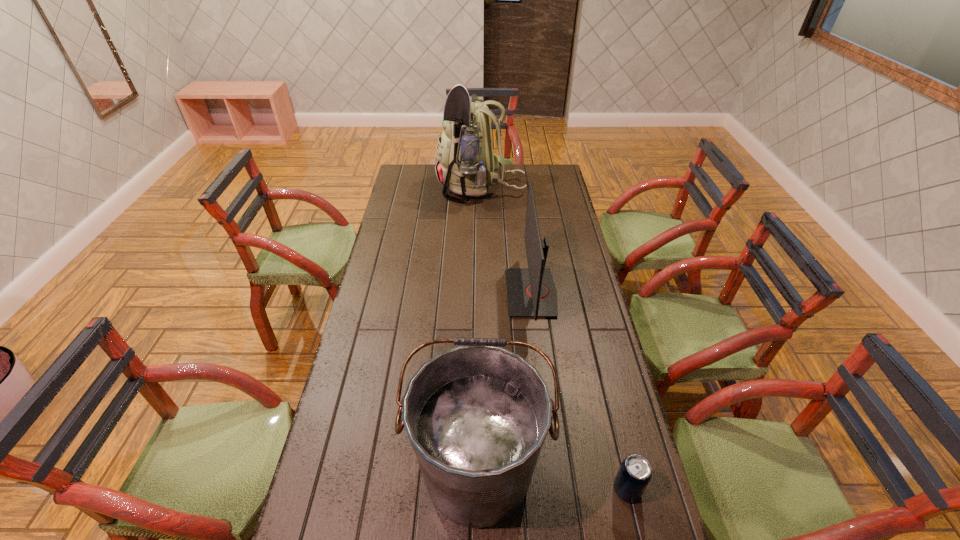
Where is `the tallest object`? This screenshot has height=540, width=960. the tallest object is located at coordinates (466, 163).

Find the location of a particular element. The width and height of the screenshot is (960, 540). backpack is located at coordinates (466, 163).

You are a GUI agent. You are given a task and a screenshot of the screen. Output one action in this format:
    pyautogui.click(x=<x>, y=<y>)
    Task: Click on the monitor
    This screenshot has height=540, width=960.
    Given the screenshot: What is the action you would take?
    pyautogui.click(x=531, y=292)

Image resolution: width=960 pixels, height=540 pixels. Identify the location of the rightmost object. (634, 474).

Where is `the shortest object`? the shortest object is located at coordinates (634, 474).

Where is `free space located on the front-facing side of the backpack`? free space located on the front-facing side of the backpack is located at coordinates (426, 187).

Image resolution: width=960 pixels, height=540 pixels. What are the coordinates of `vacant space located on the front-facing side of the backpack` in the screenshot? It's located at (400, 187).

Locate an element on the screen. vacant area located on the front-facing side of the backpack is located at coordinates (402, 187).

At what (x,y) coordinates should I click in order to perform the action: click on vacant space located on the screen side of the second farthest object. Please return your answer as a coordinate pair (x, y). The image size is (960, 540). Looking at the image, I should click on (444, 293).

Identify the location of blank space located 0.090m on the screen side of the second farthest object. The height and width of the screenshot is (540, 960). (482, 293).